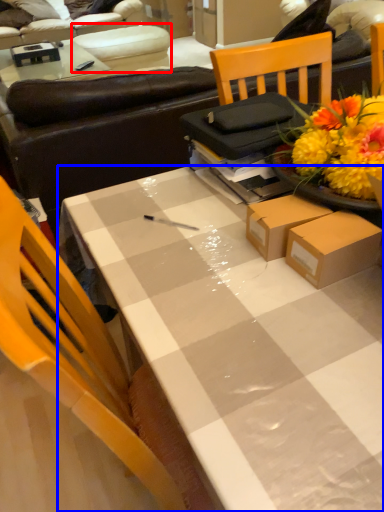
Question: Which object is closer to the camera taking this photo, armchair (highlighted by a red box) or desk (highlighted by a blue box)?

Choices:
 (A) armchair
 (B) desk

Answer: (B)